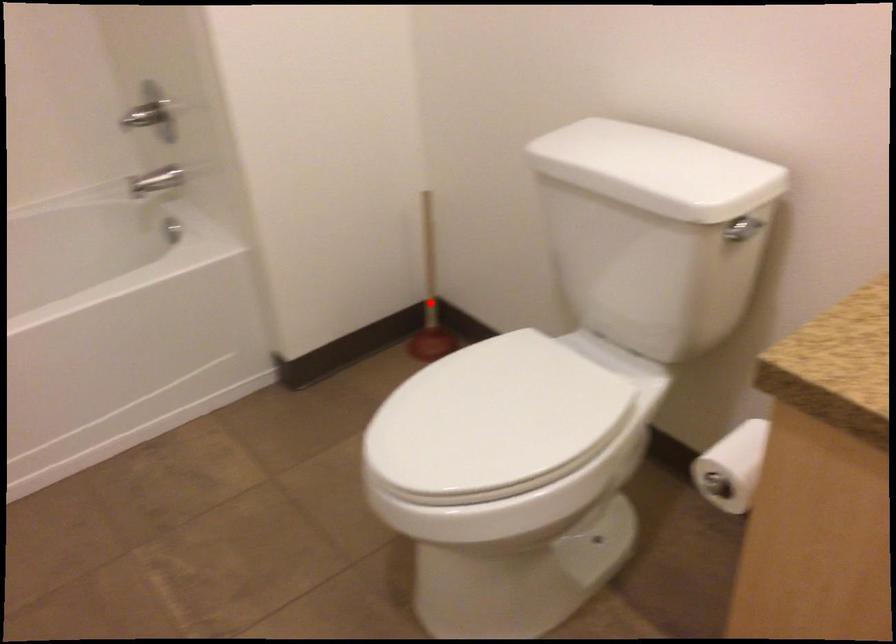
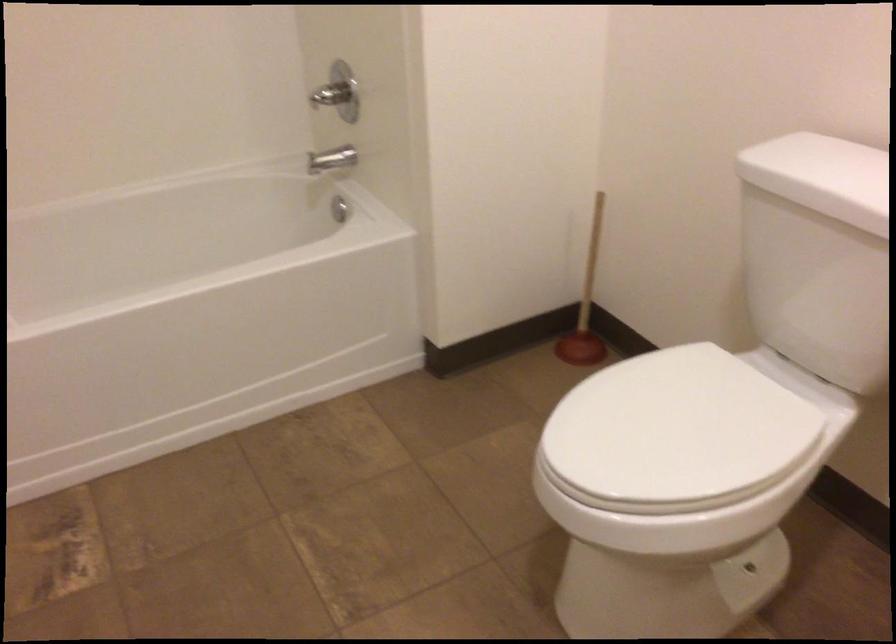
Where in the second image is the point corresponding to the highlighted location from the first image?

(586, 305)